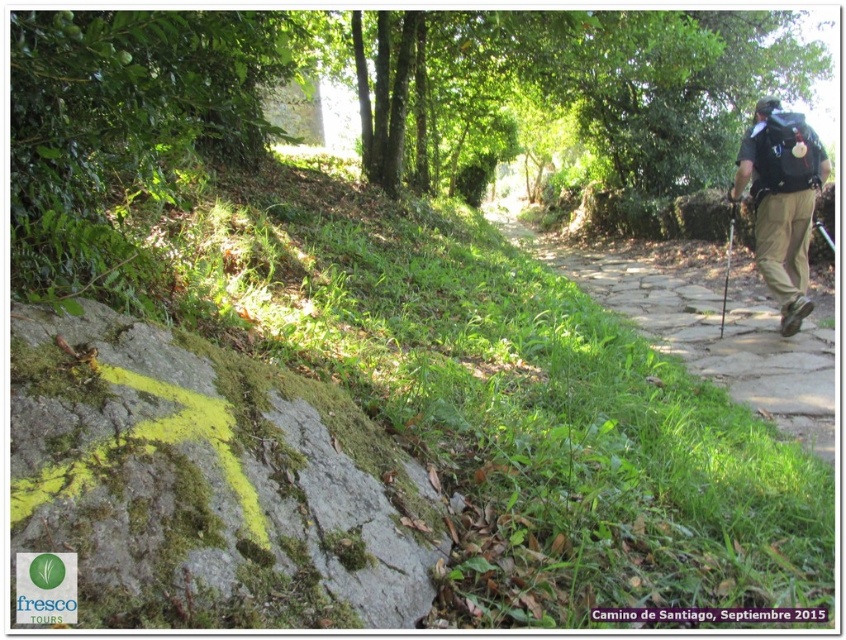
Is green mossy rock at lower left positioned behind brown stone path at right?

That is False.

Can you confirm if green mossy rock at lower left is thinner than brown stone path at right?

Yes.

Where is `green mossy rock at lower left`? This screenshot has height=640, width=846. green mossy rock at lower left is located at coordinates (206, 483).

Locate an element on the screen. The height and width of the screenshot is (640, 846). green mossy rock at lower left is located at coordinates (206, 483).

At what (x,y) coordinates should I click in order to perform the action: click on green mossy rock at lower left. Please return your answer as a coordinate pair (x, y). The width and height of the screenshot is (846, 640). Looking at the image, I should click on (206, 483).

Which is more to the left, green mossy rock at lower left or dark gray backpack at right?

Positioned to the left is green mossy rock at lower left.

Between point (103, 493) and point (773, 145), which one is positioned behind?

The point (773, 145) is behind.

Find the location of a particular element. green mossy rock at lower left is located at coordinates (206, 483).

Can you confirm if brown stone path at right is positioned above dark gray backpack at right?

Incorrect, brown stone path at right is not positioned above dark gray backpack at right.

Who is lower down, brown stone path at right or dark gray backpack at right?

brown stone path at right is below.

The height and width of the screenshot is (640, 846). In order to click on brown stone path at right in this screenshot , I will do `click(706, 332)`.